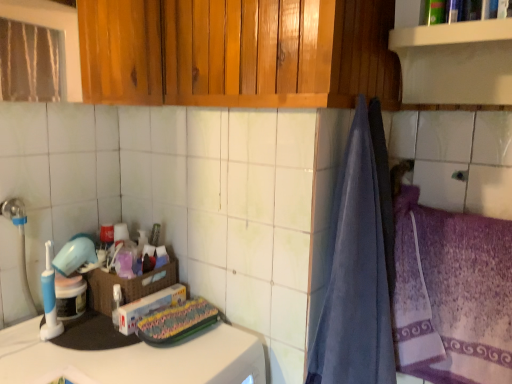
Question: From their relative heights in the image, would you say translucent plastic container at center is taller or shorter than purple textured towel at right?

Choices:
 (A) tall
 (B) short

Answer: (B)

Question: Based on their sizes in the image, would you say translucent plastic container at center is bigger or smaller than purple textured towel at right?

Choices:
 (A) big
 (B) small

Answer: (B)

Question: Which of these objects is positioned closest to the white matte shelf at upper right?

Choices:
 (A) white matte counter top at lower left
 (B) shiny wood cabinets at upper center
 (C) blue soft towel at right
 (D) woven brown basket at center
 (E) translucent plastic container at center

Answer: (B)

Question: Which object is positioned closest to the shiny wood cabinets at upper center?

Choices:
 (A) white matte shelf at upper right
 (B) white matte counter top at lower left
 (C) purple textured towel at right
 (D) woven brown basket at center
 (E) translucent plastic container at center

Answer: (A)